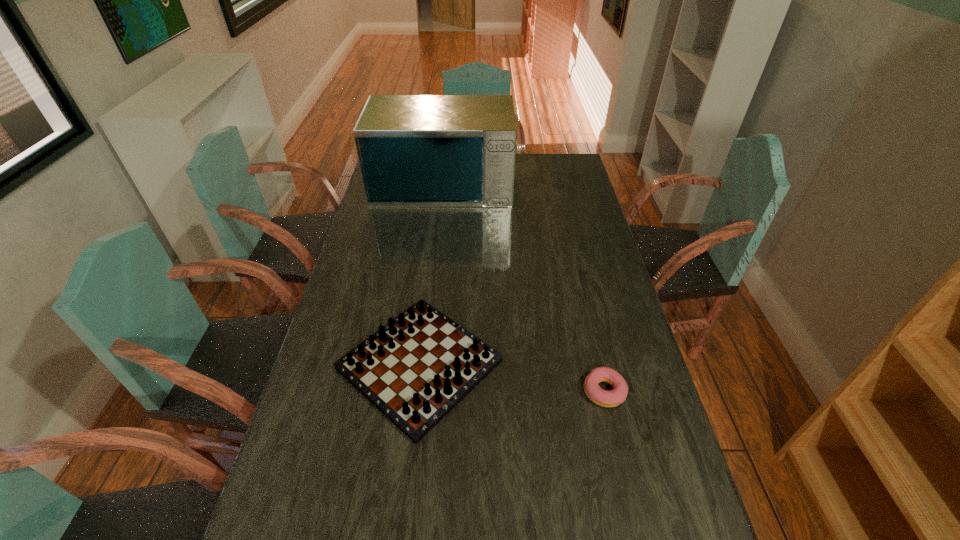
The image size is (960, 540). Find the location of `chessboard that is at the left edge`. chessboard that is at the left edge is located at coordinates (417, 368).

Identify the location of object positioned at the right edge. The image size is (960, 540). (604, 398).

Find the location of a particular element. This screenshot has width=960, height=540. object that is at the far left corner is located at coordinates (414, 150).

You are a GUI agent. You are given a task and a screenshot of the screen. Output one action in this format:
    pyautogui.click(x=<x>, y=<y>)
    Task: Click on the free location at the far edge of the desktop
    The width and height of the screenshot is (960, 540).
    Given the screenshot: What is the action you would take?
    pyautogui.click(x=516, y=168)

Find the location of `vacant space at the left edge`. vacant space at the left edge is located at coordinates (376, 268).

Where is `vacant space at the right edge of the desktop`? The width and height of the screenshot is (960, 540). vacant space at the right edge of the desktop is located at coordinates (617, 509).

At what (x,y) coordinates should I click in order to perform the action: click on free space between the second tallest object and the rightmost object. Please return your answer as a coordinate pair (x, y). This screenshot has width=960, height=540. Looking at the image, I should click on (512, 378).

This screenshot has height=540, width=960. I want to click on empty location between the chessboard and the rightmost object, so click(512, 378).

You are a GUI agent. You are given a task and a screenshot of the screen. Output one action in this format:
    pyautogui.click(x=<x>, y=<y>)
    Task: Click on the free space between the shortest object and the chessboard
    Image resolution: width=960 pixels, height=540 pixels.
    Given the screenshot: What is the action you would take?
    pyautogui.click(x=512, y=378)

At what (x,y) coordinates should I click in order to perform the action: click on free space that is in between the chessboard and the farthest object. Please return your answer as a coordinate pair (x, y). Looking at the image, I should click on (432, 272).